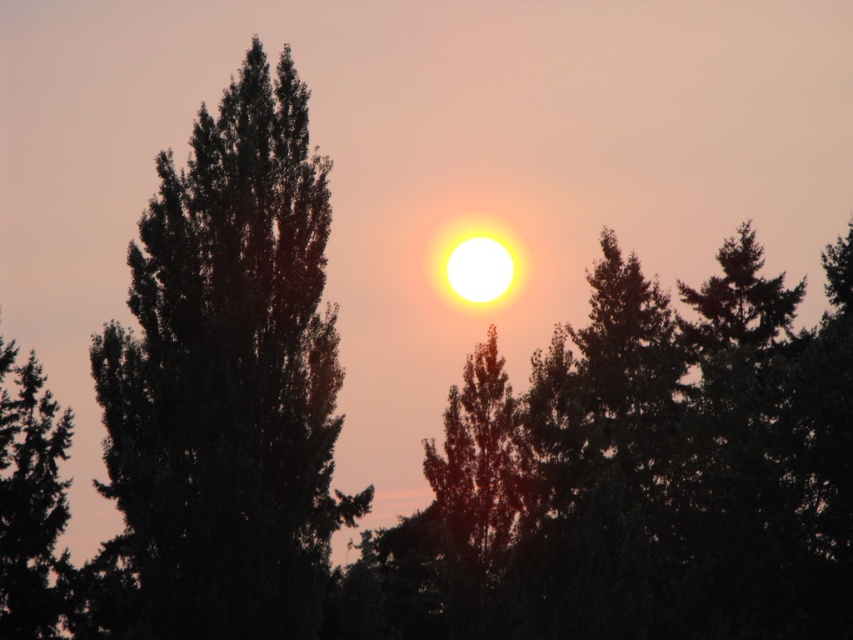
You are an observer standing in the middle of the field looking at the sunset. You see the dark green leafy tree at left and the dark green textured tree at left. Which tree appears taller to you?

The dark green leafy tree at left appears taller than the dark green textured tree at left because it is much taller as stated in the description.